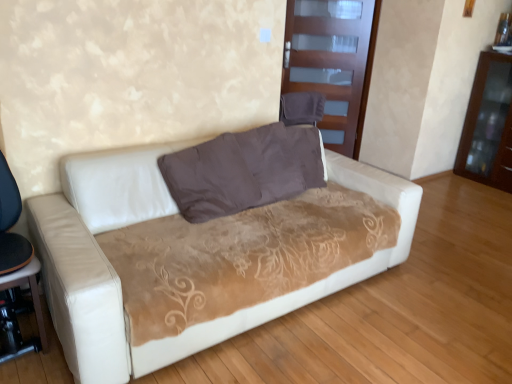
Question: From the image's perspective, is brown glossy dresser at right positioned above or below transparent glass door at upper center?

Choices:
 (A) below
 (B) above

Answer: (A)

Question: In terms of height, does brown glossy dresser at right look taller or shorter compared to transparent glass door at upper center?

Choices:
 (A) short
 (B) tall

Answer: (A)

Question: Which of these objects is positioned farthest from the black plastic table at lower left?

Choices:
 (A) brown glossy dresser at right
 (B) brown suede pillow at center
 (C) transparent glass door at upper center
 (D) white leather couch at center

Answer: (A)

Question: Estimate the real-world distances between objects in this image. Which object is closer to the transparent glass door at upper center?

Choices:
 (A) brown glossy dresser at right
 (B) brown suede pillow at center
 (C) white leather couch at center
 (D) black plastic table at lower left

Answer: (A)